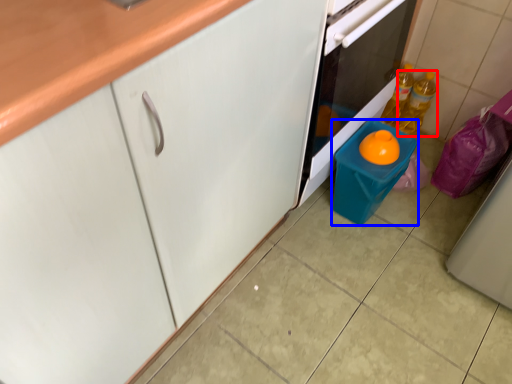
Question: Which object is further to the camera taking this photo, bottle (highlighted by a red box) or appliance (highlighted by a blue box)?

Choices:
 (A) bottle
 (B) appliance

Answer: (A)